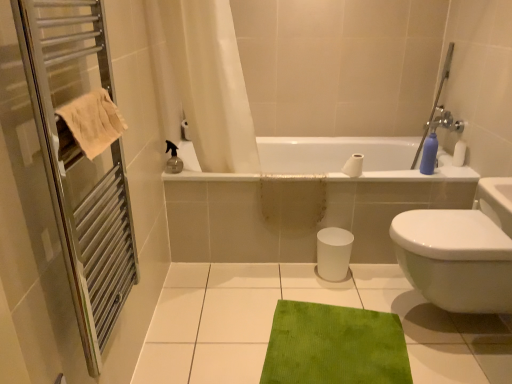
The image size is (512, 384). What do you see at coordinates (430, 151) in the screenshot?
I see `blue matte bottle at upper right` at bounding box center [430, 151].

This screenshot has width=512, height=384. What do you see at coordinates (307, 200) in the screenshot? I see `white glossy bathtub at center` at bounding box center [307, 200].

Find the location of `beige cotton towel at left`. beige cotton towel at left is located at coordinates (93, 121).

Describe the element at coordinates (202, 81) in the screenshot. This screenshot has height=384, width=512. I see `white fabric shower curtain at upper center` at that location.

What is the approximate width of metal towel rack at left?

It is 5.54 inches.

The image size is (512, 384). I want to click on white glossy bidet at lower right, so click(455, 259).

Is point (234, 355) behind point (454, 298)?

No.

Is green textured mat at lower center turned away from white glossy bidet at lower right?

No, white glossy bidet at lower right is not at the back of green textured mat at lower center.

Who is shorter, green textured mat at lower center or white glossy bidet at lower right?

Standing shorter between the two is green textured mat at lower center.

Which object is further away from the camera taking this photo, green textured mat at lower center or white glossy bidet at lower right?

green textured mat at lower center is further from the camera.

Which object is positioned more to the right, green textured mat at lower center or white glossy bathtub at center?

white glossy bathtub at center is more to the right.

Is green textured mat at lower center further to camera compared to white glossy bathtub at center?

That is False.

How different are the orientations of green textured mat at lower center and white glossy bathtub at center in degrees?

The angle between the facing direction of green textured mat at lower center and the facing direction of white glossy bathtub at center is 90.2 degrees.

Does green textured mat at lower center have a lesser width compared to white glossy bathtub at center?

In fact, green textured mat at lower center might be wider than white glossy bathtub at center.

Can you confirm if white fabric shower curtain at upper center is smaller than green velvety bath mat at center?

No.

Looking at this image, from the image's perspective, would you say white fabric shower curtain at upper center is shown under green velvety bath mat at center?

No, from the image's perspective, white fabric shower curtain at upper center is not beneath green velvety bath mat at center.

Who is shorter, white fabric shower curtain at upper center or green velvety bath mat at center?

Standing shorter between the two is green velvety bath mat at center.

Considering the relative sizes of white fabric shower curtain at upper center and green velvety bath mat at center in the image provided, is white fabric shower curtain at upper center thinner than green velvety bath mat at center?

Indeed, white fabric shower curtain at upper center has a lesser width compared to green velvety bath mat at center.

Is green textured mat at lower center spatially inside green velvety bath mat at center, or outside of it?

green textured mat at lower center is not inside green velvety bath mat at center, it's outside.

From the image's perspective, which object appears higher, green textured mat at lower center or green velvety bath mat at center?

green textured mat at lower center, from the image's perspective.

Is green textured mat at lower center wider than green velvety bath mat at center?

Correct, the width of green textured mat at lower center exceeds that of green velvety bath mat at center.

Is green textured mat at lower center not near green velvety bath mat at center?

No, green textured mat at lower center is not far from green velvety bath mat at center.

The image size is (512, 384). I want to click on beach towel in front of the blue matte bottle at upper right, so click(93, 121).

Which is more to the left, beige cotton towel at left or blue matte bottle at upper right?

beige cotton towel at left is more to the left.

Is white glossy bidet at lower right looking in the opposite direction of beige cotton towel at left?

white glossy bidet at lower right is not turned away from beige cotton towel at left.

The image size is (512, 384). I want to click on bidet below the beige cotton towel at left (from the image's perspective), so click(x=455, y=259).

What's the angular difference between white glossy bidet at lower right and beige cotton towel at left's facing directions?

The facing directions of white glossy bidet at lower right and beige cotton towel at left are 180 degrees apart.

Can beige cotton towel at left be found inside white glossy bidet at lower right?

That's incorrect, beige cotton towel at left is not inside white glossy bidet at lower right.

Looking at this image, looking at the image, does white fabric shower curtain at upper center seem bigger or smaller compared to metal towel rack at left?

Considering their sizes, white fabric shower curtain at upper center takes up more space than metal towel rack at left.

Does white fabric shower curtain at upper center have a lesser height compared to metal towel rack at left?

In fact, white fabric shower curtain at upper center may be taller than metal towel rack at left.

Considering the relative sizes of white fabric shower curtain at upper center and metal towel rack at left in the image provided, is white fabric shower curtain at upper center wider than metal towel rack at left?

Indeed, white fabric shower curtain at upper center has a greater width compared to metal towel rack at left.

Locate an element on the screen. bidet above the green textured mat at lower center (from a real-world perspective) is located at coordinates (455, 259).

This screenshot has width=512, height=384. I want to click on bathtub above the green textured mat at lower center (from the image's perspective), so click(307, 200).

When comparing their distances from white glossy bathtub at center, does blue matte bottle at upper right or green velvety bath mat at center seem closer?

The object closer to white glossy bathtub at center is blue matte bottle at upper right.

Which object lies nearer to the anchor point white matte toilet paper at upper center, white fabric shower curtain at upper center or beige cotton towel at left?

white fabric shower curtain at upper center is closer to white matte toilet paper at upper center.

When comparing their distances from white glossy bidet at lower right, does metal towel rack at left or white fabric shower curtain at upper center seem further?

Based on the image, metal towel rack at left appears to be further to white glossy bidet at lower right.

Which object lies further to the anchor point beige cotton towel at left, blue matte bottle at upper right or white glossy bidet at lower right?

blue matte bottle at upper right lies further to beige cotton towel at left than the other object.

Looking at the image, which one is located closer to white glossy bidet at lower right, green velvety bath mat at center or white fabric shower curtain at upper center?

green velvety bath mat at center is closer to white glossy bidet at lower right.

From the image, which object appears to be farther from blue matte bottle at upper right, green velvety bath mat at center or beige cotton towel at left?

beige cotton towel at left.

Estimate the real-world distances between objects in this image. Which object is closer to green textured mat at lower center, blue matte bottle at upper right or white fabric shower curtain at upper center?

Based on the image, white fabric shower curtain at upper center appears to be nearer to green textured mat at lower center.

When comparing their distances from metal towel rack at left, does white matte toilet paper at upper center or beige cotton towel at left seem closer?

The object closer to metal towel rack at left is beige cotton towel at left.

Locate an element on the screen. The image size is (512, 384). ceramic tile located between metal towel rack at left and white glossy bidet at lower right in the left-right direction is located at coordinates (309, 301).

Where is `ceramic tile between metal towel rack at left and white glossy bathtub at center along the z-axis`? The image size is (512, 384). ceramic tile between metal towel rack at left and white glossy bathtub at center along the z-axis is located at coordinates (309, 301).

This screenshot has height=384, width=512. Find the location of `toilet paper that lies between blue matte bottle at upper right and white glossy bidet at lower right from top to bottom`. toilet paper that lies between blue matte bottle at upper right and white glossy bidet at lower right from top to bottom is located at coordinates (353, 165).

You are a GUI agent. You are given a task and a screenshot of the screen. Output one action in this format:
    pyautogui.click(x=<x>, y=<y>)
    Task: Click on the shower curtain between metal towel rack at left and white glossy bathtub at center in the front-back direction
    
    Given the screenshot: What is the action you would take?
    pyautogui.click(x=202, y=81)